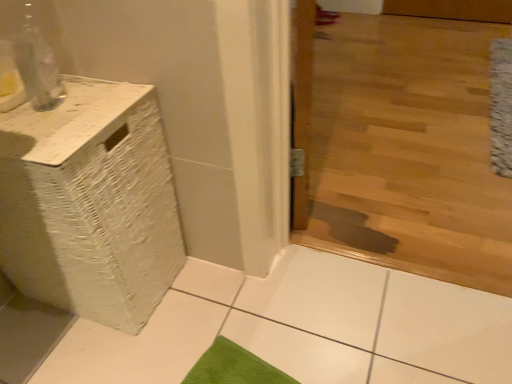
I want to click on free space in front of white woven basket at left, so click(x=86, y=358).